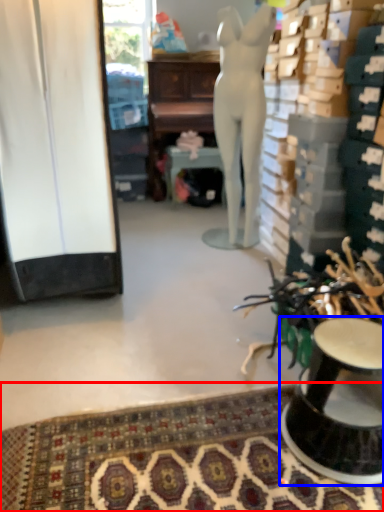
Question: Which point is further to the camera, mat (highlighted by a red box) or furniture (highlighted by a blue box)?

Choices:
 (A) mat
 (B) furniture

Answer: (B)